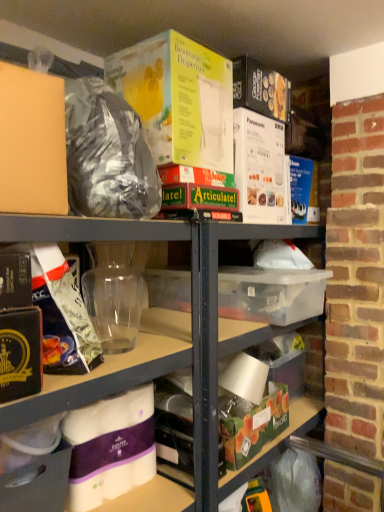
Question: Is shiny metallic bag at upper left not inside transparent plastic storage box at center, placed as the second storage box when sorted from left to right?

Choices:
 (A) no
 (B) yes

Answer: (B)

Question: Does shiny metallic bag at upper left appear on the right side of transparent plastic storage box at center, acting as the second storage box starting from the right?

Choices:
 (A) no
 (B) yes

Answer: (A)

Question: Considering the relative sizes of shiny metallic bag at upper left and transparent plastic storage box at center, placed as the second storage box when sorted from left to right, in the image provided, is shiny metallic bag at upper left wider than transparent plastic storage box at center, placed as the second storage box when sorted from left to right,?

Choices:
 (A) yes
 (B) no

Answer: (B)

Question: Is shiny metallic bag at upper left positioned with its back to transparent plastic storage box at center, arranged as the 3th storage box when ordered from the bottom?

Choices:
 (A) yes
 (B) no

Answer: (B)

Question: Is the position of shiny metallic bag at upper left more distant than that of transparent plastic storage box at center, placed as the second storage box when sorted from left to right?

Choices:
 (A) yes
 (B) no

Answer: (B)

Question: From a real-world perspective, relative to transparent plastic jar at center, positioned as the second yoghurt in top-to-bottom order, is transparent plastic storage box at center, acting as the second storage box starting from the right, vertically above or below?

Choices:
 (A) above
 (B) below

Answer: (B)

Question: Is transparent plastic storage box at center, arranged as the 3th storage box when ordered from the bottom, in front of or behind transparent plastic jar at center, which is the second yoghurt from bottom to top, in the image?

Choices:
 (A) front
 (B) behind

Answer: (B)

Question: From the image's perspective, is transparent plastic storage box at center, acting as the second storage box starting from the right, positioned above or below transparent plastic jar at center, positioned as the second yoghurt in top-to-bottom order?

Choices:
 (A) above
 (B) below

Answer: (B)

Question: Considering the positions of point (269, 289) and point (132, 246), is point (269, 289) closer or farther from the camera than point (132, 246)?

Choices:
 (A) closer
 (B) farther

Answer: (A)

Question: Based on their sizes in the image, would you say purple paper towel at lower left, positioned as the 1th yoghurt in bottom-to-top order, is bigger or smaller than transparent plastic jar at center, positioned as the second yoghurt in top-to-bottom order?

Choices:
 (A) small
 (B) big

Answer: (B)

Question: Is purple paper towel at lower left, which ranks as the 3th yoghurt in top-to-bottom order, in front of or behind transparent plastic jar at center, which is the second yoghurt from bottom to top, in the image?

Choices:
 (A) behind
 (B) front

Answer: (B)

Question: In the image, is purple paper towel at lower left, which ranks as the 3th yoghurt in top-to-bottom order, on the left side or the right side of transparent plastic jar at center, which is the second yoghurt from bottom to top?

Choices:
 (A) right
 (B) left

Answer: (B)

Question: Does point (125, 446) appear closer or farther from the camera than point (96, 329)?

Choices:
 (A) farther
 (B) closer

Answer: (B)

Question: In terms of size, does transparent plastic jar at center, positioned as the second yoghurt in top-to-bottom order, appear bigger or smaller than purple paper towel at lower left, positioned as the 1th yoghurt in bottom-to-top order?

Choices:
 (A) small
 (B) big

Answer: (A)

Question: Considering their positions, is transparent plastic jar at center, positioned as the second yoghurt in top-to-bottom order, located in front of or behind purple paper towel at lower left, positioned as the 1th yoghurt in bottom-to-top order?

Choices:
 (A) behind
 (B) front

Answer: (A)